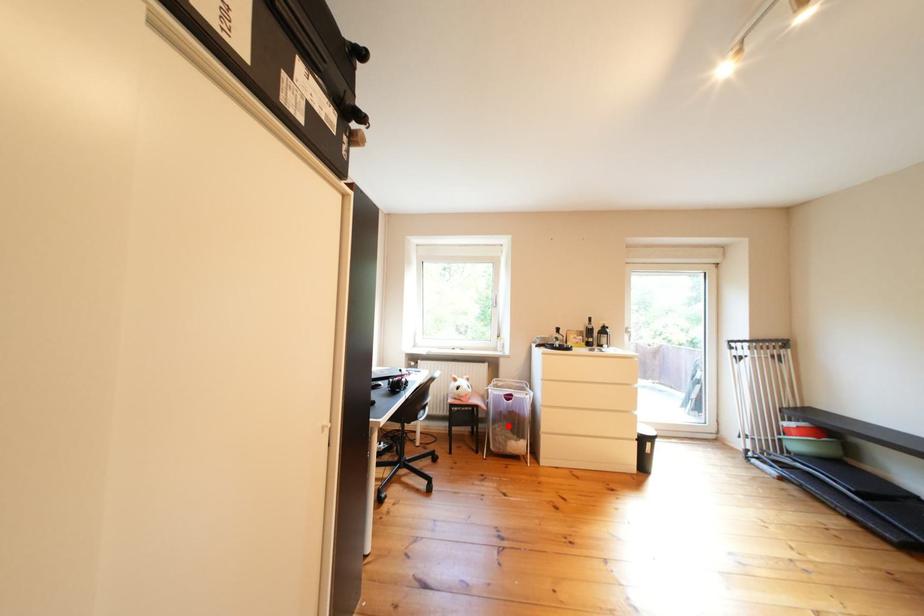
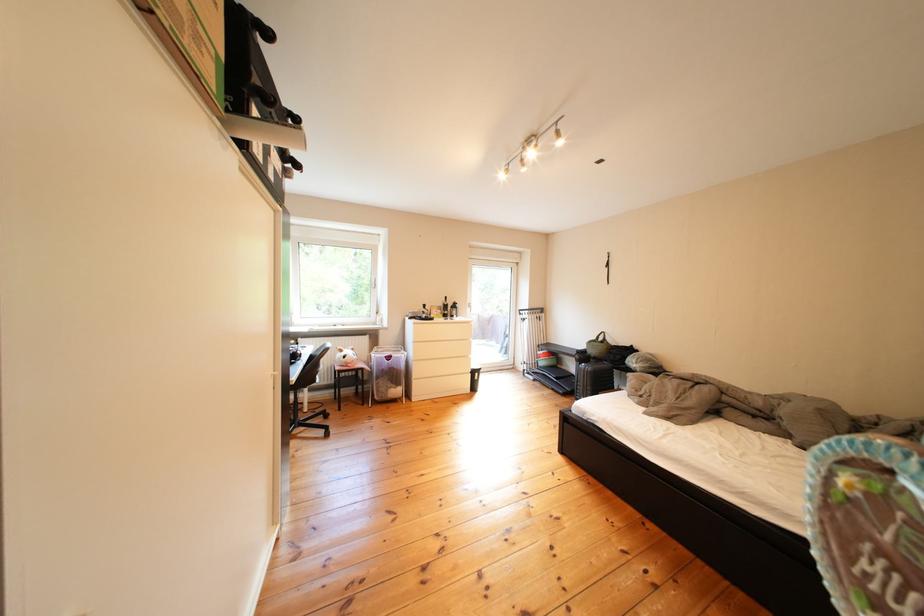
Question: I am providing you with two images of the same scene from different viewpoints. In image1, a red point is highlighted. Considering the same 3D point in image2, which of the following is correct?

Choices:
 (A) It is closer
 (B) It is farther

Answer: (A)